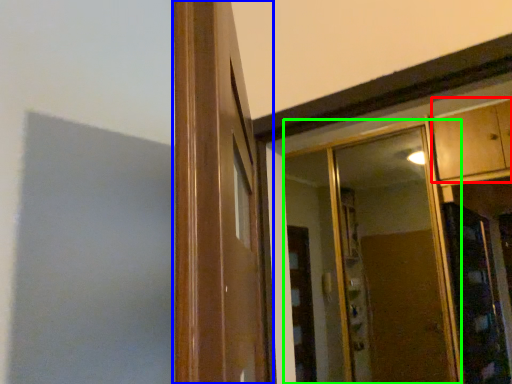
Question: Based on their relative distances, which object is farther from cabinetry (highlighted by a red box)? Choose from window frame (highlighted by a blue box) and mirror (highlighted by a green box).

Choices:
 (A) window frame
 (B) mirror

Answer: (A)